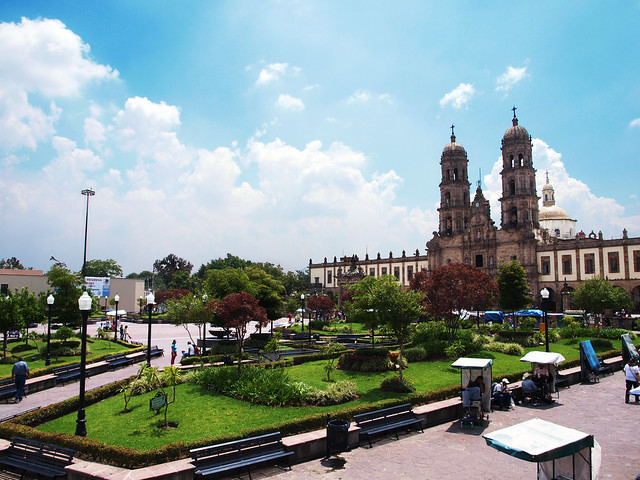
You are a GUI agent. You are given a task and a screenshot of the screen. Output one action in this format:
    pyautogui.click(x=<x>, y=<y>)
    Task: Click on the light
    The image size is (640, 480).
    Given the screenshot: What is the action you would take?
    pyautogui.click(x=543, y=294)